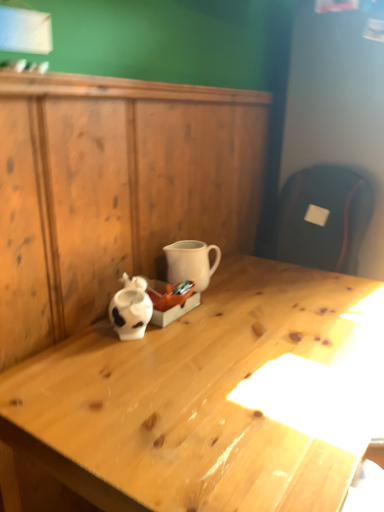
Question: From the image's perspective, does light wood desk at center appear higher than wooden dresser at center?

Choices:
 (A) yes
 (B) no

Answer: (B)

Question: Is light wood desk at center outside of wooden dresser at center?

Choices:
 (A) yes
 (B) no

Answer: (A)

Question: Considering the relative sizes of light wood desk at center and wooden dresser at center in the image provided, is light wood desk at center shorter than wooden dresser at center?

Choices:
 (A) yes
 (B) no

Answer: (A)

Question: Can you confirm if light wood desk at center is bigger than wooden dresser at center?

Choices:
 (A) no
 (B) yes

Answer: (B)

Question: Is light wood desk at center touching wooden dresser at center?

Choices:
 (A) no
 (B) yes

Answer: (A)

Question: From their relative heights in the image, would you say wooden dresser at center is taller or shorter than white matte coffee cup at center?

Choices:
 (A) tall
 (B) short

Answer: (A)

Question: Looking at the image, does wooden dresser at center seem bigger or smaller compared to white matte coffee cup at center?

Choices:
 (A) small
 (B) big

Answer: (B)

Question: From a real-world perspective, is wooden dresser at center above or below white matte coffee cup at center?

Choices:
 (A) below
 (B) above

Answer: (A)

Question: Is point (79, 84) closer or farther from the camera than point (200, 253)?

Choices:
 (A) farther
 (B) closer

Answer: (B)

Question: Is wooden dresser at center wider or thinner than light wood desk at center?

Choices:
 (A) wide
 (B) thin

Answer: (B)

Question: From the image's perspective, is wooden dresser at center located above or below light wood desk at center?

Choices:
 (A) above
 (B) below

Answer: (A)

Question: Looking at the image, does wooden dresser at center seem bigger or smaller compared to light wood desk at center?

Choices:
 (A) big
 (B) small

Answer: (B)

Question: Is wooden dresser at center in front of or behind light wood desk at center in the image?

Choices:
 (A) front
 (B) behind

Answer: (B)

Question: Considering the positions of light wood desk at center and white matte coffee cup at center in the image, is light wood desk at center wider or thinner than white matte coffee cup at center?

Choices:
 (A) thin
 (B) wide

Answer: (B)

Question: Considering their positions, is light wood desk at center located in front of or behind white matte coffee cup at center?

Choices:
 (A) front
 (B) behind

Answer: (A)